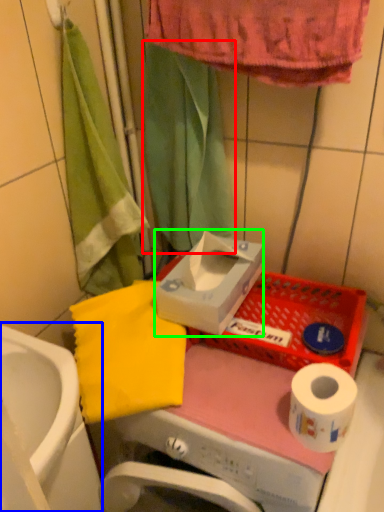
Question: Which object is the closest to the shower curtain (highlighted by a red box)? Choose among these: sink (highlighted by a blue box) or carton (highlighted by a green box).

Choices:
 (A) sink
 (B) carton

Answer: (B)